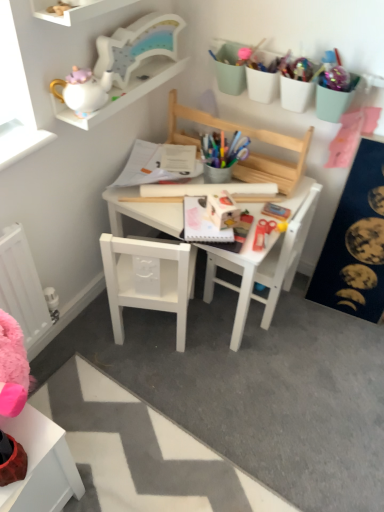
You are a GUI agent. You are given a task and a screenshot of the screen. Output one action in this format:
    pyautogui.click(x=<x>, y=<y>)
    Task: Click on the vacant space to the right of white wooden chair at center, arranged as the 1th chair when viewed from the right
    This screenshot has height=512, width=384.
    Given the screenshot: What is the action you would take?
    pyautogui.click(x=304, y=318)